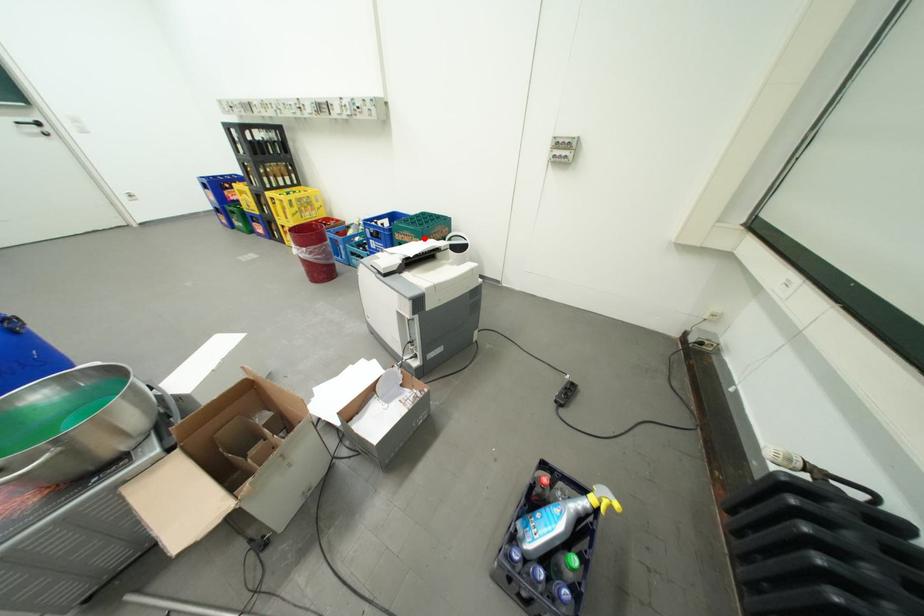
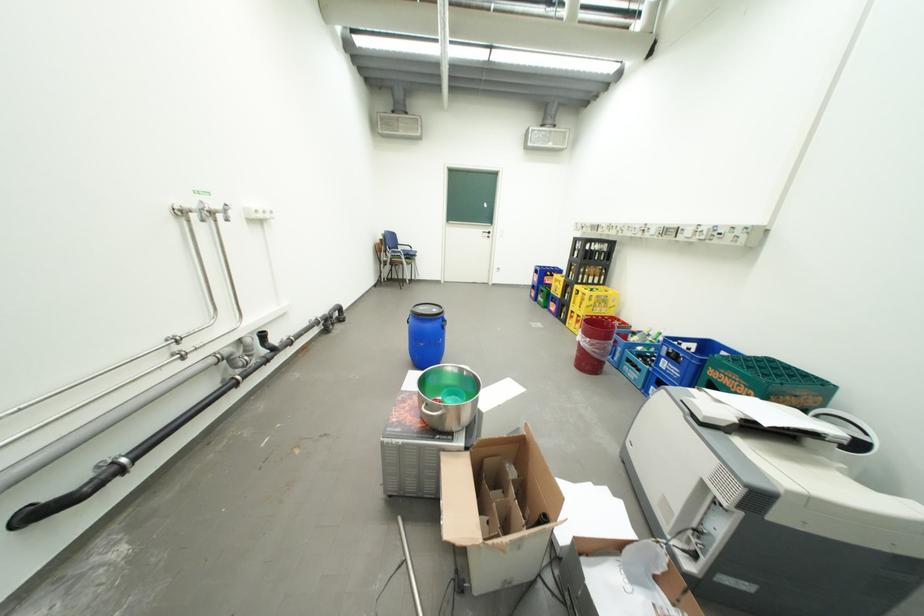
Question: I am providing you with two images of the same scene from different viewpoints. Image1 has a red point marked. In image2, the corresponding 3D location appears at what relative position? Reply with the corresponding letter.

Choices:
 (A) Closer
 (B) Farther

Answer: (A)